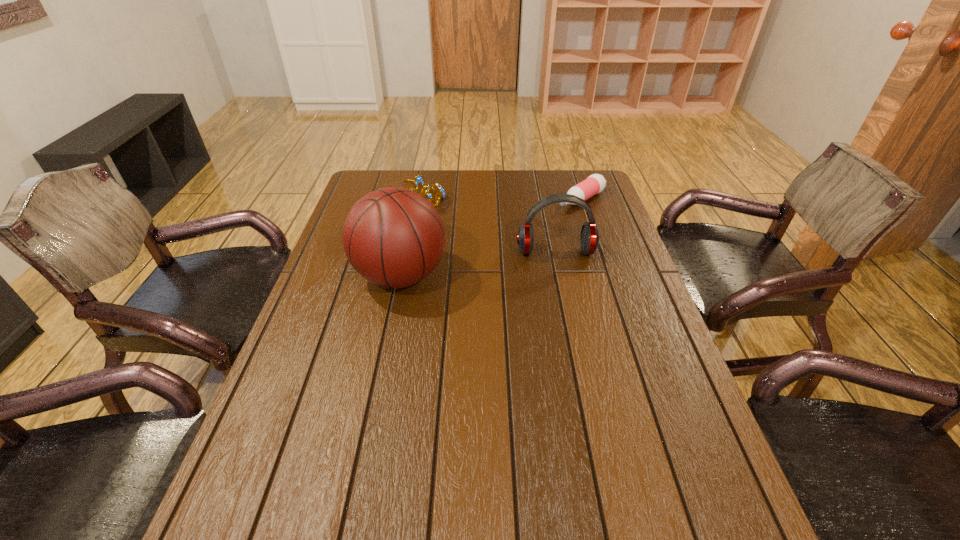
Where is `free space on the desktop that is between the basketball and the earphone and is positioned on the front-facing side of the tiara`? The width and height of the screenshot is (960, 540). free space on the desktop that is between the basketball and the earphone and is positioned on the front-facing side of the tiara is located at coordinates (466, 266).

Image resolution: width=960 pixels, height=540 pixels. In order to click on vacant space on the desktop that is between the tallest object and the earphone and is positioned with the cap open on the bottle in this screenshot , I will do `click(480, 264)`.